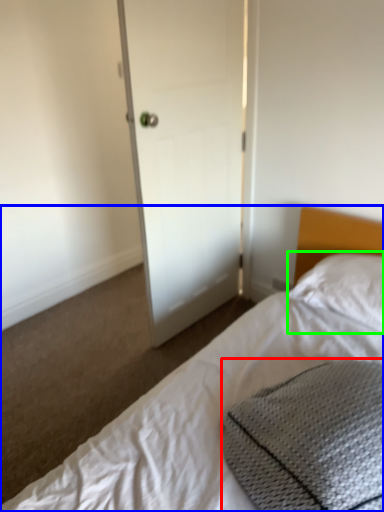
Question: Considering the real-world distances, which object is closest to material (highlighted by a red box)? bed (highlighted by a blue box) or pillow (highlighted by a green box).

Choices:
 (A) bed
 (B) pillow

Answer: (A)